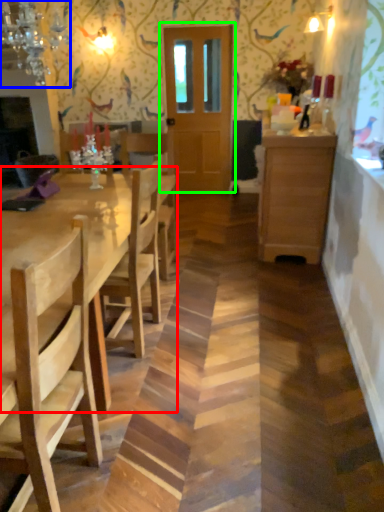
Question: Which object is positioned farthest from kitchen & dining room table (highlighted by a red box)? Select from light fixture (highlighted by a blue box) and door (highlighted by a green box).

Choices:
 (A) light fixture
 (B) door

Answer: (B)